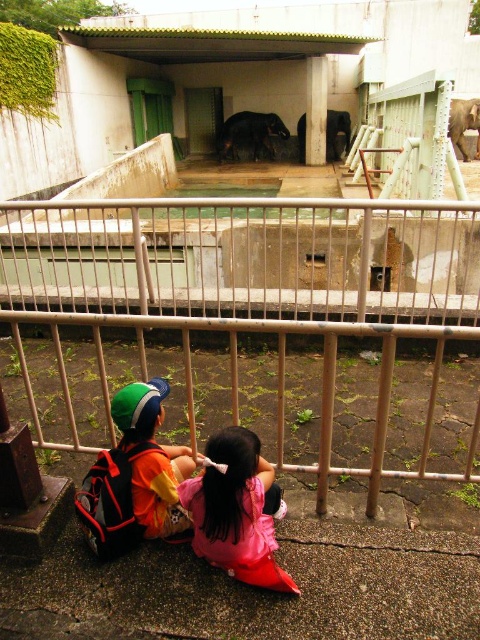
Does pink fabric at lower center appear over shiny black elephant at center?

No.

Locate an element on the screen. pink fabric at lower center is located at coordinates (236, 509).

Does matte green cap at lower left have a greater width compared to shiny black elephant at center?

Incorrect, matte green cap at lower left's width does not surpass shiny black elephant at center's.

Is point (154, 396) more distant than point (335, 138)?

No.

At what (x,y) coordinates should I click in order to perform the action: click on matte green cap at lower left. Please return your answer as a coordinate pair (x, y). Image resolution: width=480 pixels, height=640 pixels. Looking at the image, I should click on (153, 458).

Is point (205, 516) positioned behind point (129, 426)?

That is False.

Who is taller, pink fabric at lower center or matte green cap at lower left?

Standing taller between the two is matte green cap at lower left.

Is point (204, 524) behind point (179, 458)?

That is False.

Find the location of a particular element. Image resolution: width=480 pixels, height=640 pixels. pink fabric at lower center is located at coordinates (236, 509).